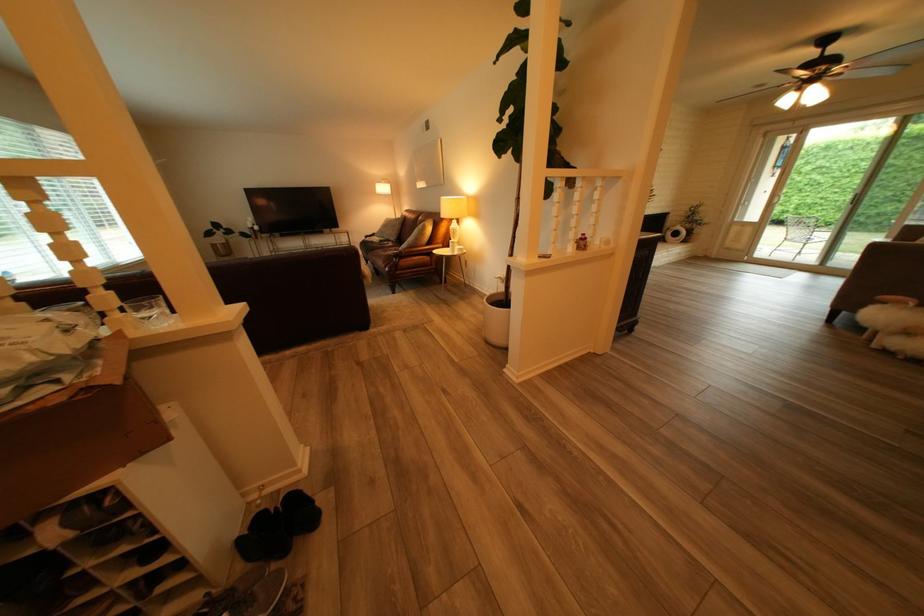
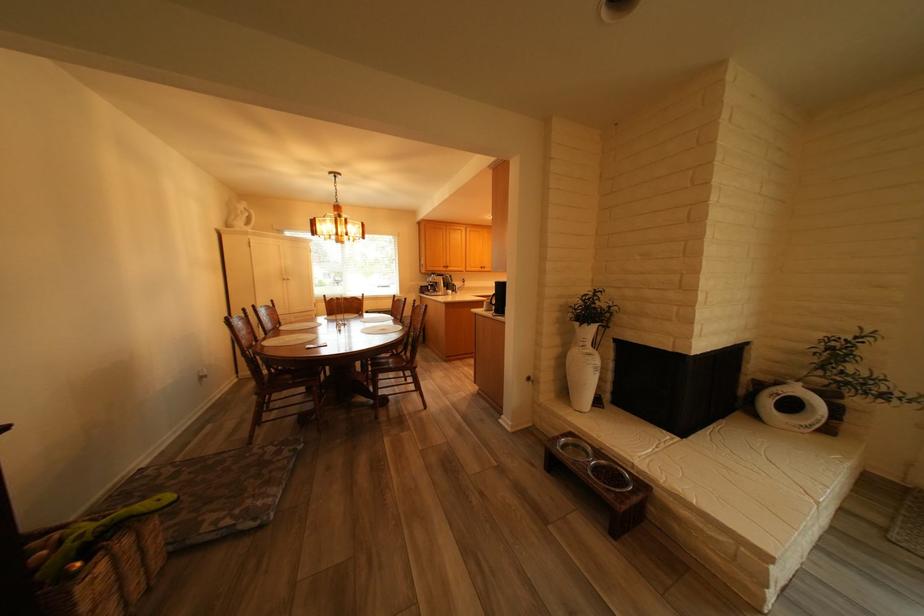
The images are taken continuously from a first-person perspective. In which direction are you moving?

The cameraman walked toward right, forward.